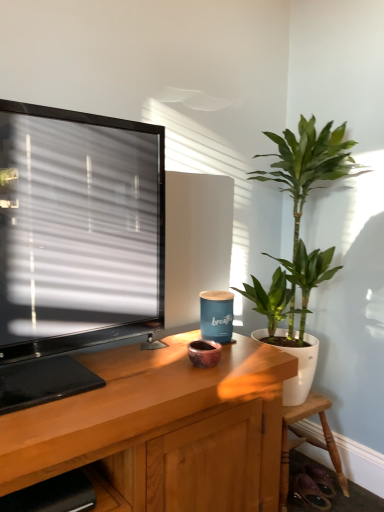
Question: Is wooden chair at lower right taller or shorter than green glossy plant at right?

Choices:
 (A) short
 (B) tall

Answer: (A)

Question: Is wooden chair at lower right in front of or behind green glossy plant at right in the image?

Choices:
 (A) behind
 (B) front

Answer: (A)

Question: Which of these objects is positioned farthest from the green glossy plant at right?

Choices:
 (A) wooden shelf at lower left
 (B) wooden chair at lower right

Answer: (A)

Question: Estimate the real-world distances between objects in this image. Which object is closer to the wooden shelf at lower left?

Choices:
 (A) wooden chair at lower right
 (B) green glossy plant at right

Answer: (A)